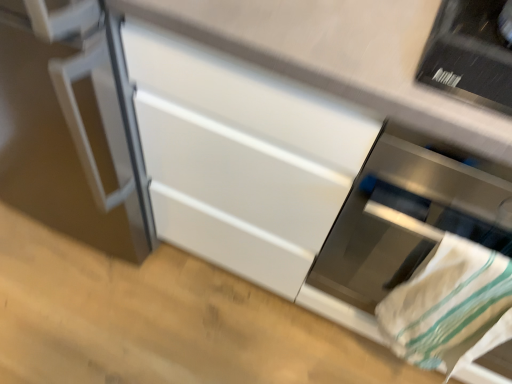
Question: Is stainless steel oven at lower right positioned before white cotton towel at lower right?

Choices:
 (A) yes
 (B) no

Answer: (A)

Question: From the image's perspective, is stainless steel oven at lower right under white cotton towel at lower right?

Choices:
 (A) yes
 (B) no

Answer: (B)

Question: Considering the relative sizes of stainless steel oven at lower right and white cotton towel at lower right in the image provided, is stainless steel oven at lower right taller than white cotton towel at lower right?

Choices:
 (A) yes
 (B) no

Answer: (A)

Question: Is stainless steel oven at lower right looking in the opposite direction of white cotton towel at lower right?

Choices:
 (A) no
 (B) yes

Answer: (B)

Question: Considering the relative sizes of stainless steel oven at lower right and white cotton towel at lower right in the image provided, is stainless steel oven at lower right shorter than white cotton towel at lower right?

Choices:
 (A) no
 (B) yes

Answer: (A)

Question: Can you confirm if stainless steel oven at lower right is positioned to the left of white cotton towel at lower right?

Choices:
 (A) no
 (B) yes

Answer: (A)

Question: Considering the relative sizes of white cotton towel at lower right and stainless steel oven at lower right in the image provided, is white cotton towel at lower right thinner than stainless steel oven at lower right?

Choices:
 (A) no
 (B) yes

Answer: (B)

Question: Is white cotton towel at lower right outside of stainless steel oven at lower right?

Choices:
 (A) no
 (B) yes

Answer: (A)

Question: From the image's perspective, is white cotton towel at lower right on top of stainless steel oven at lower right?

Choices:
 (A) yes
 (B) no

Answer: (B)

Question: From the image's perspective, does white cotton towel at lower right appear lower than stainless steel oven at lower right?

Choices:
 (A) no
 (B) yes

Answer: (B)

Question: Is there a large distance between white cotton towel at lower right and stainless steel oven at lower right?

Choices:
 (A) yes
 (B) no

Answer: (B)

Question: From a real-world perspective, is white cotton towel at lower right positioned under stainless steel oven at lower right based on gravity?

Choices:
 (A) yes
 (B) no

Answer: (A)

Question: Considering the relative positions of stainless steel oven at lower right and white cotton towel at lower right in the image provided, is stainless steel oven at lower right to the left or to the right of white cotton towel at lower right?

Choices:
 (A) left
 (B) right

Answer: (B)